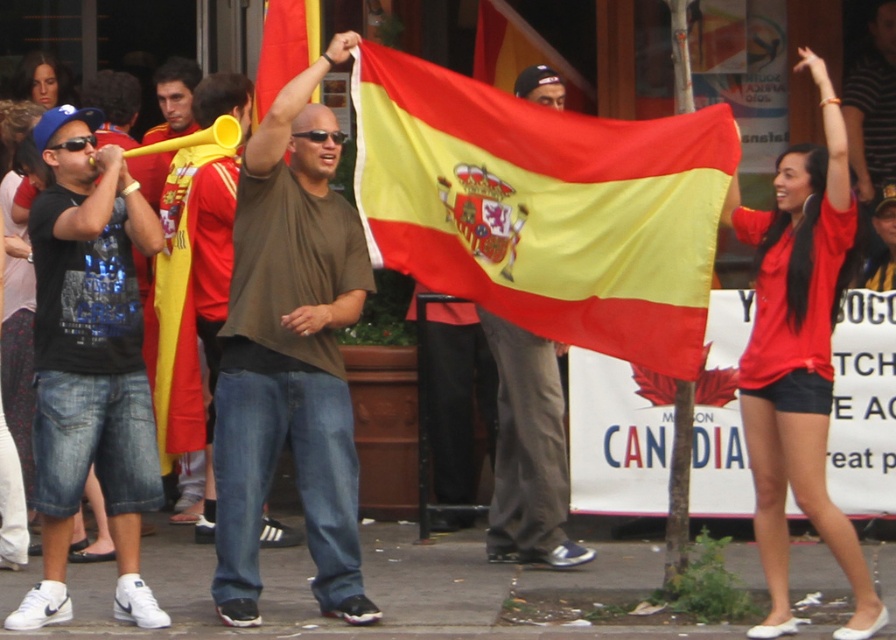
Question: Among these points, which one is farthest from the camera?

Choices:
 (A) (76, 323)
 (B) (483, 280)
 (C) (238, 264)

Answer: (C)

Question: Considering the real-world distances, which object is farthest from the matte yellow horn at center?

Choices:
 (A) black denim shorts at left
 (B) matte red shirt at center
 (C) red/yellow fabric flag at center
 (D) silky fabric flag at center

Answer: (B)

Question: Does matte red shirt at center have a smaller size compared to matte yellow horn at center?

Choices:
 (A) no
 (B) yes

Answer: (A)

Question: From the image, what is the correct spatial relationship of black denim shorts at left in relation to matte red shirt at center?

Choices:
 (A) above
 (B) below

Answer: (B)

Question: Which point appears closest to the camera in this image?

Choices:
 (A) (774, 580)
 (B) (160, 113)
 (C) (519, 260)

Answer: (A)

Question: Does silky fabric flag at center appear on the left side of red/yellow fabric flag at center?

Choices:
 (A) no
 (B) yes

Answer: (A)